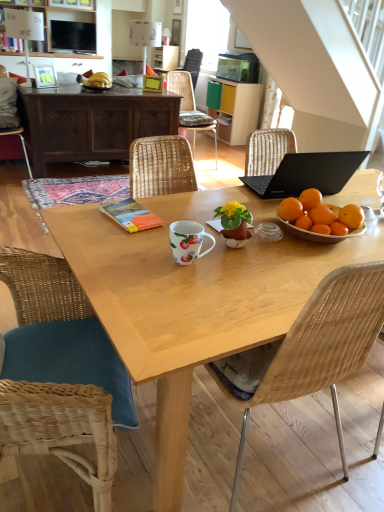
At what (x,y) coordinates should I click in order to perform the action: click on vacant space to the right of orange matte book at center. Please return your answer as a coordinate pair (x, y). Looking at the image, I should click on (174, 211).